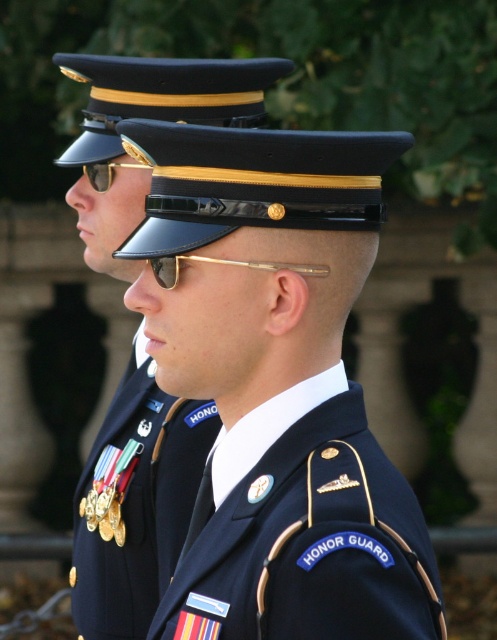
Which is behind, point (341, 490) or point (92, 173)?

Point (92, 173)

Where is `navy blue fabric uniform at center`? This screenshot has height=640, width=497. navy blue fabric uniform at center is located at coordinates [305, 531].

Does navy blue fabric uniform at center appear over gold metallic medals at center?

No, navy blue fabric uniform at center is not above gold metallic medals at center.

Is point (253, 595) more distant than point (193, 500)?

That is False.

This screenshot has height=640, width=497. In order to click on navy blue fabric uniform at center in this screenshot , I will do `click(305, 531)`.

Is navy blue uniform at center smaller than gold reflective sunglasses at upper center?

Actually, navy blue uniform at center might be larger than gold reflective sunglasses at upper center.

Is point (120, 234) positioned in front of point (111, 170)?

That is False.

This screenshot has height=640, width=497. In order to click on navy blue uniform at center in this screenshot , I will do `click(136, 500)`.